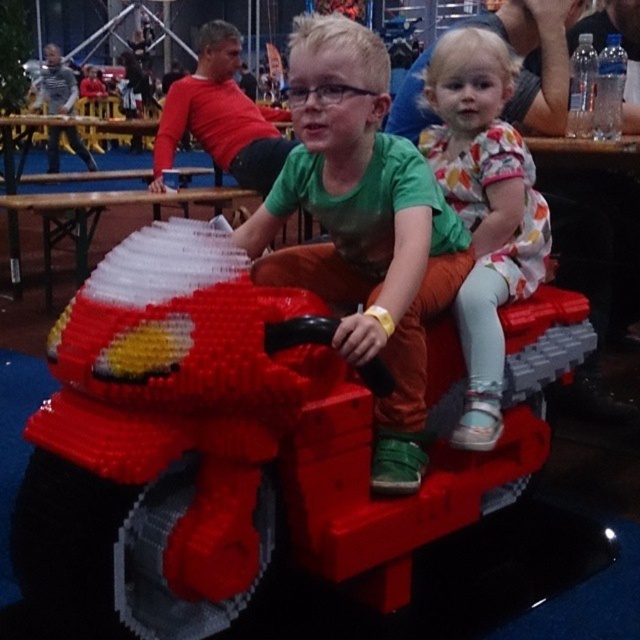
Does red plastic motorcycle at center have a smaller size compared to floral dress at center?

Actually, red plastic motorcycle at center might be larger than floral dress at center.

Does point (67, 397) come closer to viewer compared to point (499, 90)?

That is True.

You are a GUI agent. You are given a task and a screenshot of the screen. Output one action in this format:
    pyautogui.click(x=<x>, y=<y>)
    Task: Click on the red plastic motorcycle at center
    
    Given the screenshot: What is the action you would take?
    pyautogui.click(x=244, y=429)

Is point (97, 339) farther from viewer compared to point (412, 394)?

No.

Locate an element on the screen. The image size is (640, 640). red plastic motorcycle at center is located at coordinates (244, 429).

Is point (460, 268) positioned in front of point (477, 150)?

Yes, point (460, 268) is in front of point (477, 150).

Locate an element on the screen. The image size is (640, 640). matte plastic boy at center is located at coordinates (362, 227).

What are the coordinates of `matte plastic boy at center` in the screenshot? It's located at (362, 227).